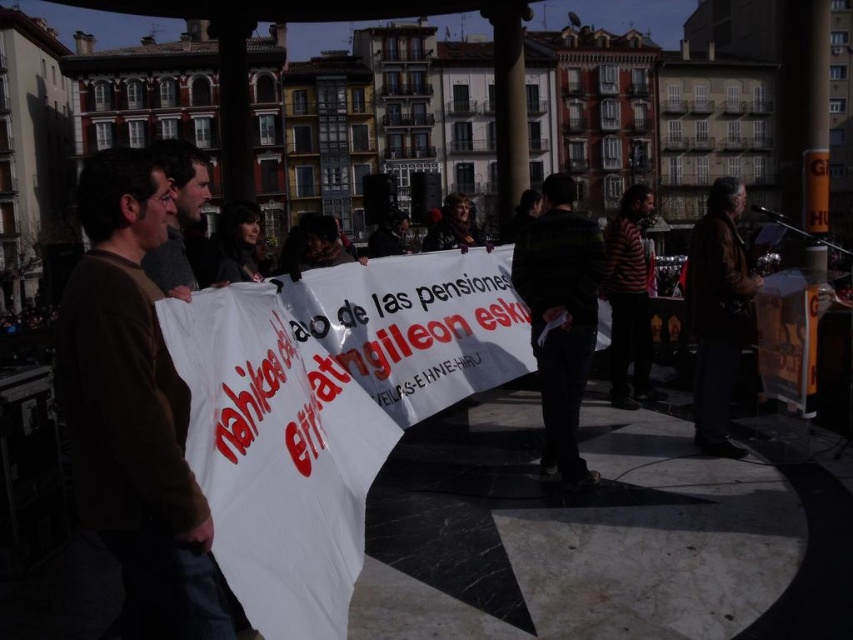
Question: Which of the following is the farthest from the observer?

Choices:
 (A) (556, 234)
 (B) (375, 236)

Answer: (B)

Question: Among these objects, which one is nearest to the camera?

Choices:
 (A) matte black jacket at center
 (B) gray knit sweater at left
 (C) dark green sweater at center

Answer: (B)

Question: Is brown sweater at left to the left of brown leather jacket at right from the viewer's perspective?

Choices:
 (A) yes
 (B) no

Answer: (A)

Question: Does gray knit sweater at left appear on the left side of matte black jacket at center?

Choices:
 (A) no
 (B) yes

Answer: (B)

Question: Which point is farther to the camera?

Choices:
 (A) (532, 291)
 (B) (131, 160)
 (C) (170, 141)
 (D) (688, 282)

Answer: (D)

Question: Can you confirm if dark green sweater at center is thinner than gray knit sweater at left?

Choices:
 (A) no
 (B) yes

Answer: (B)